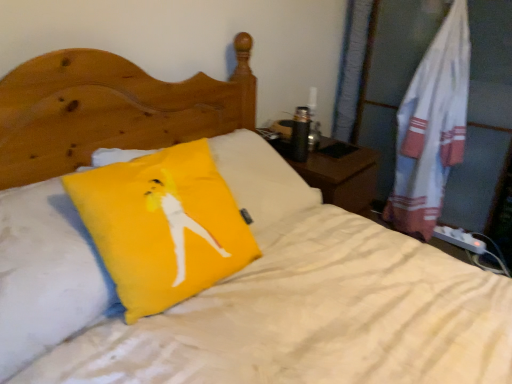
Question: Is white cotton towel at right inside or outside of yellow fabric pillow at center, placed as the second pillow when sorted from right to left?

Choices:
 (A) outside
 (B) inside

Answer: (A)

Question: Considering their positions, is white cotton towel at right located in front of or behind yellow fabric pillow at center, which is the first pillow in left-to-right order?

Choices:
 (A) behind
 (B) front

Answer: (A)

Question: Which object is the closest to the yellow fabric pillow at center, arranged as the 1th pillow when viewed from the right?

Choices:
 (A) white cotton towel at right
 (B) yellow fabric pillow at center, which is the first pillow in left-to-right order

Answer: (B)

Question: Which object is positioned farthest from the yellow fabric pillow at center, placed as the second pillow when sorted from right to left?

Choices:
 (A) yellow fabric pillow at center, acting as the 2th pillow starting from the left
 (B) white cotton towel at right

Answer: (B)